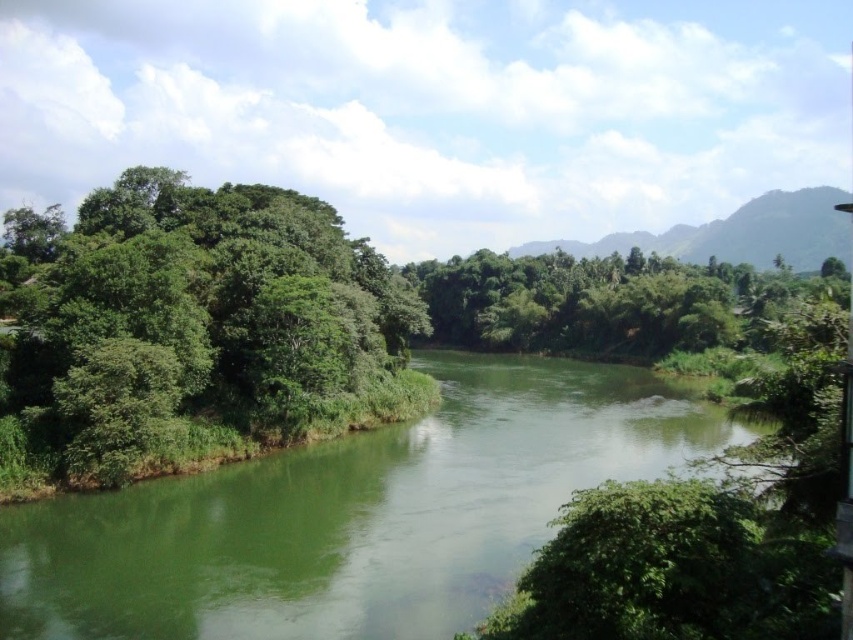
Question: Is green leafy trees at left smaller than green leafy trees at center?

Choices:
 (A) yes
 (B) no

Answer: (A)

Question: Considering the real-world distances, which object is farthest from the green leafy trees at center?

Choices:
 (A) green smooth river at center
 (B) green leafy trees at left

Answer: (A)

Question: Which point is farther from the camera taking this photo?

Choices:
 (A) (781, 305)
 (B) (193, 413)

Answer: (A)

Question: Does green smooth river at center have a greater width compared to green leafy trees at left?

Choices:
 (A) no
 (B) yes

Answer: (A)

Question: Which point is farther to the camera?

Choices:
 (A) green leafy trees at center
 (B) green smooth river at center

Answer: (B)

Question: Where is green leafy trees at left located in relation to green leafy trees at center in the image?

Choices:
 (A) below
 (B) above

Answer: (A)